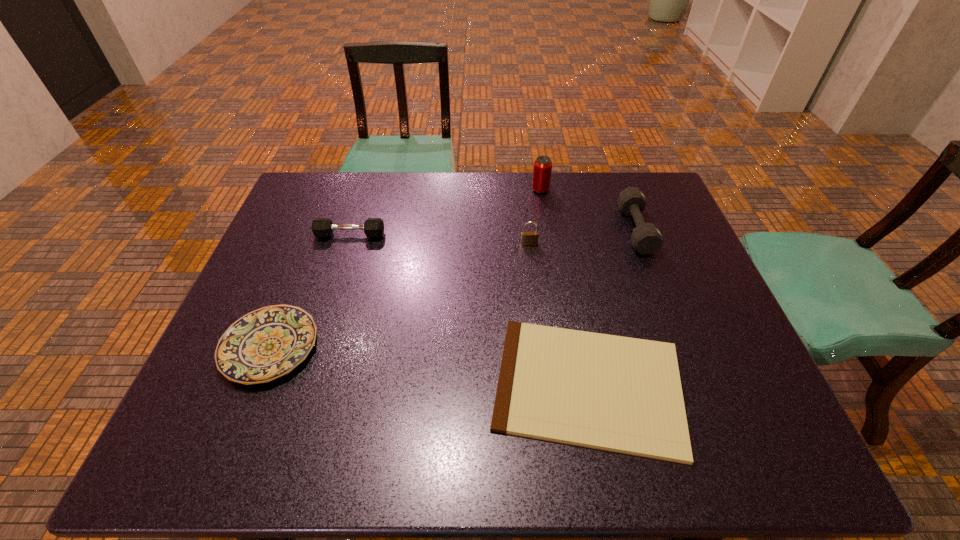
In order to click on clipboard located at the right edge in this screenshot , I will do `click(620, 394)`.

Locate an element on the screen. object located in the far right corner section of the desktop is located at coordinates (x=646, y=238).

This screenshot has width=960, height=540. Identify the location of object situated at the near right corner. (620, 394).

This screenshot has height=540, width=960. I want to click on free space at the far edge of the desktop, so click(598, 187).

The height and width of the screenshot is (540, 960). In order to click on vacant space at the near edge of the desktop in this screenshot , I will do `click(420, 456)`.

In the image, there is a desktop. At what (x,y) coordinates should I click in order to perform the action: click on vacant space at the right edge. Please return your answer as a coordinate pair (x, y). This screenshot has height=540, width=960. Looking at the image, I should click on (679, 233).

You are a GUI agent. You are given a task and a screenshot of the screen. Output one action in this format:
    pyautogui.click(x=<x>, y=<y>)
    Task: Click on the vacant area that lies between the clipboard and the fifth tallest object
    
    Given the screenshot: What is the action you would take?
    pyautogui.click(x=429, y=366)

I want to click on free space between the third shortest object and the plate, so click(x=310, y=291).

Locate an element on the screen. The width and height of the screenshot is (960, 540). free space between the padlock and the third shortest object is located at coordinates (440, 239).

Image resolution: width=960 pixels, height=540 pixels. What are the coordinates of `vacant area that lies between the shorter dumbbell and the right dumbbell` in the screenshot? It's located at (492, 232).